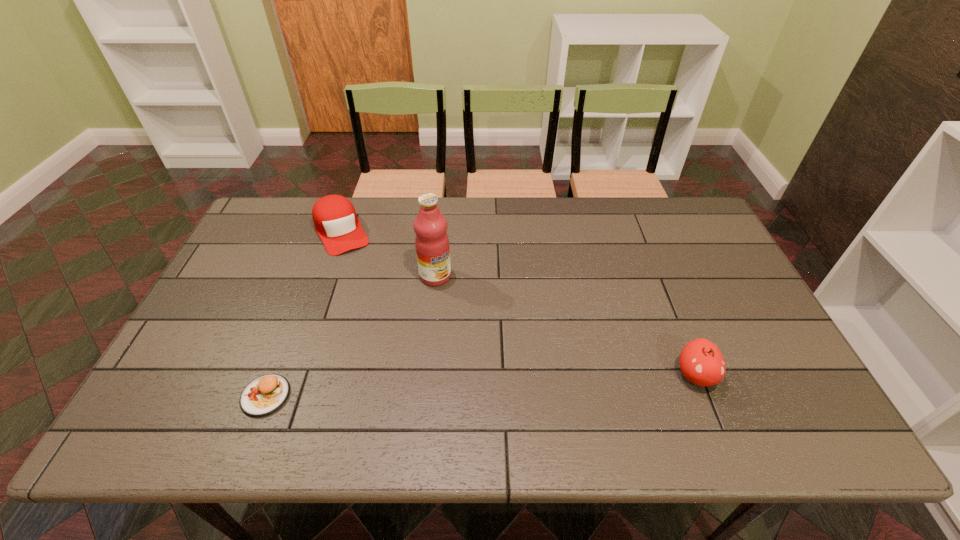
You are a GUI agent. You are given a task and a screenshot of the screen. Output one action in this format:
    pyautogui.click(x=<x>, y=<y>)
    Task: Click on the vacant area that lies between the tallest object and the patty
    
    Given the screenshot: What is the action you would take?
    pyautogui.click(x=350, y=336)

Identify which object is located as the third nearest to the second object from right to left. Please provide its 2D coordinates. Your answer should be formatted as a tuple, i.e. [(x, y)], where the tuple contains the x and y coordinates of a point satisfying the conditions above.

[(701, 362)]

The image size is (960, 540). I want to click on object that is the closest to the fruit juice, so click(x=335, y=220).

The image size is (960, 540). I want to click on free space that satisfies the following two spatial constraints: 1. on the back side of the baseball cap; 2. on the left side of the patty, so click(328, 232).